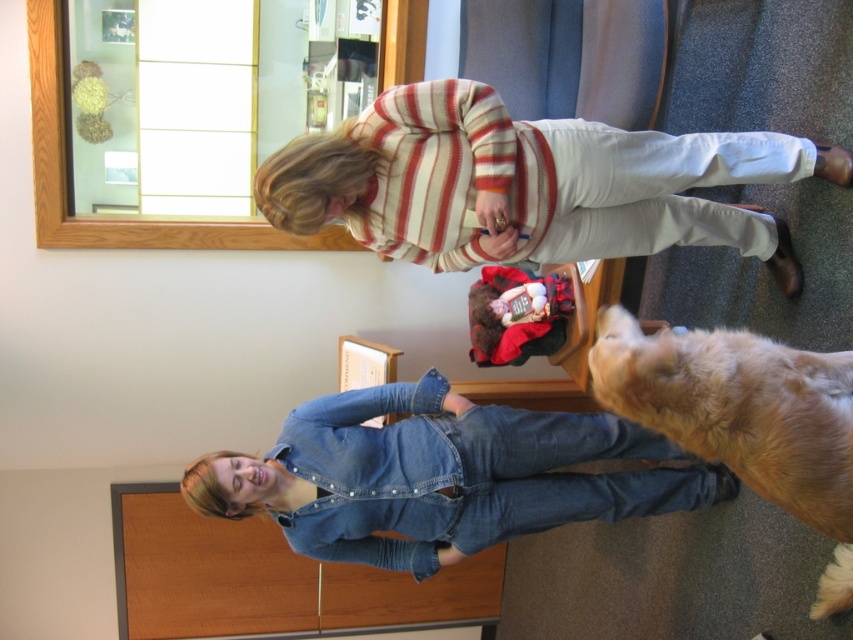
Question: Which object is farther from the camera taking this photo?

Choices:
 (A) striped sweater at upper center
 (B) golden fur dog at lower right
 (C) denim overalls at lower center

Answer: (C)

Question: Which point is closer to the camera?

Choices:
 (A) (403, 140)
 (B) (781, 397)
 (C) (643, 436)

Answer: (B)

Question: Which point is farther from the camera taking this photo?

Choices:
 (A) (457, 444)
 (B) (821, 518)
 (C) (583, 152)

Answer: (A)

Question: Is striped sweater at upper center smaller than golden fur dog at lower right?

Choices:
 (A) yes
 (B) no

Answer: (B)

Question: Can you confirm if denim overalls at lower center is wider than golden fur dog at lower right?

Choices:
 (A) no
 (B) yes

Answer: (B)

Question: Can you confirm if striped sweater at upper center is bigger than golden fur dog at lower right?

Choices:
 (A) yes
 (B) no

Answer: (A)